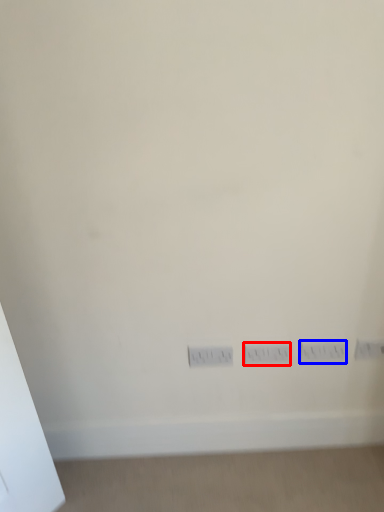
Question: Which of the following is the farthest to the observer, switch (highlighted by a red box) or electric outlet (highlighted by a blue box)?

Choices:
 (A) switch
 (B) electric outlet

Answer: (A)